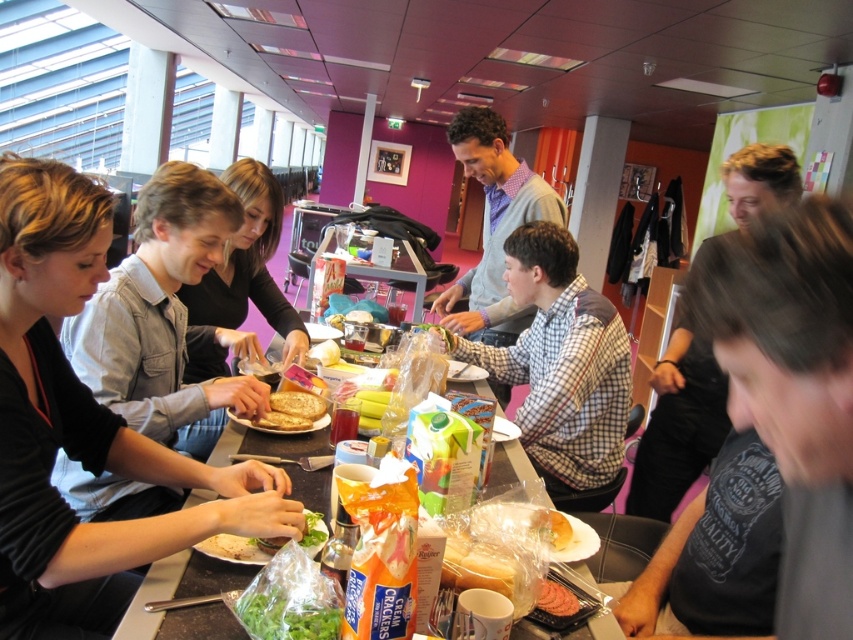
Question: Is matte black shirt at left thinner than black cotton shirt at right?

Choices:
 (A) yes
 (B) no

Answer: (B)

Question: Is matte black shirt at left to the right of white crumbly bread at center from the viewer's perspective?

Choices:
 (A) yes
 (B) no

Answer: (B)

Question: Is gray sweater at center below sliced pink meat at center?

Choices:
 (A) no
 (B) yes

Answer: (A)

Question: Which point is farther to the camera?

Choices:
 (A) matte black shirt at center
 (B) black shirt at right

Answer: (B)

Question: Which point is farther to the camera?

Choices:
 (A) white paper plate at center
 (B) matte black shirt at left

Answer: (B)

Question: Based on their relative distances, which object is nearer to the white checkered shirt at center?

Choices:
 (A) black shirt at right
 (B) white crumbly bread at center

Answer: (A)